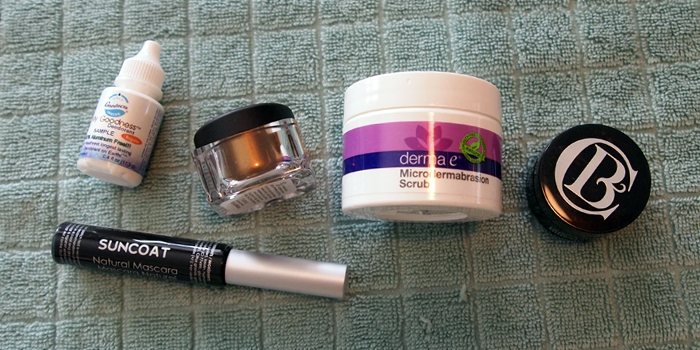
This screenshot has width=700, height=350. I want to click on towel surface, so click(x=552, y=54).